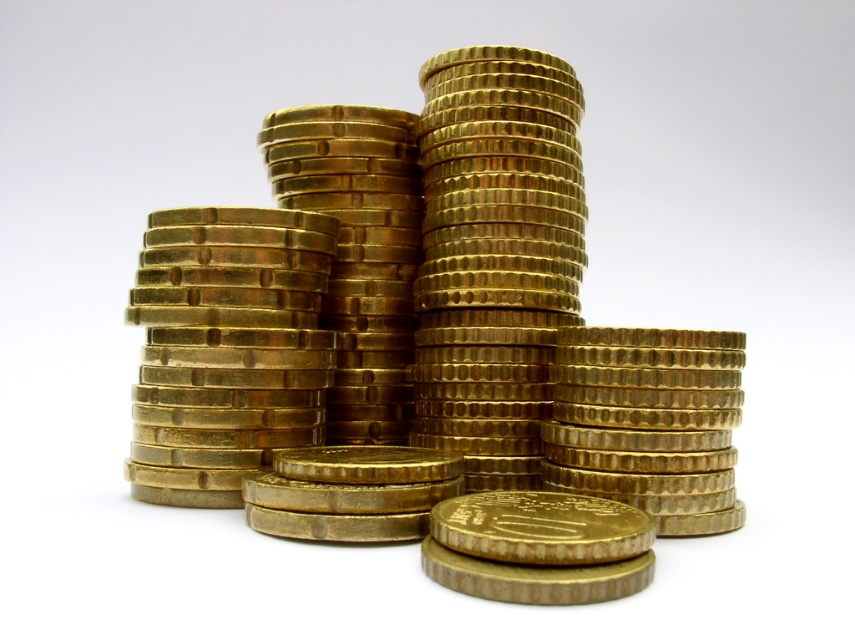
Question: Is gold shiny coins at center in front of gold metallic coin at center?

Choices:
 (A) yes
 (B) no

Answer: (A)

Question: Can you confirm if gold shiny coins at center is wider than gold metallic coin at center?

Choices:
 (A) yes
 (B) no

Answer: (A)

Question: Can you confirm if gold shiny coins at center is smaller than gold metallic coin at center?

Choices:
 (A) no
 (B) yes

Answer: (A)

Question: Which of the following is the closest to the observer?

Choices:
 (A) gold shiny coins at center
 (B) gold metallic coin at center

Answer: (A)